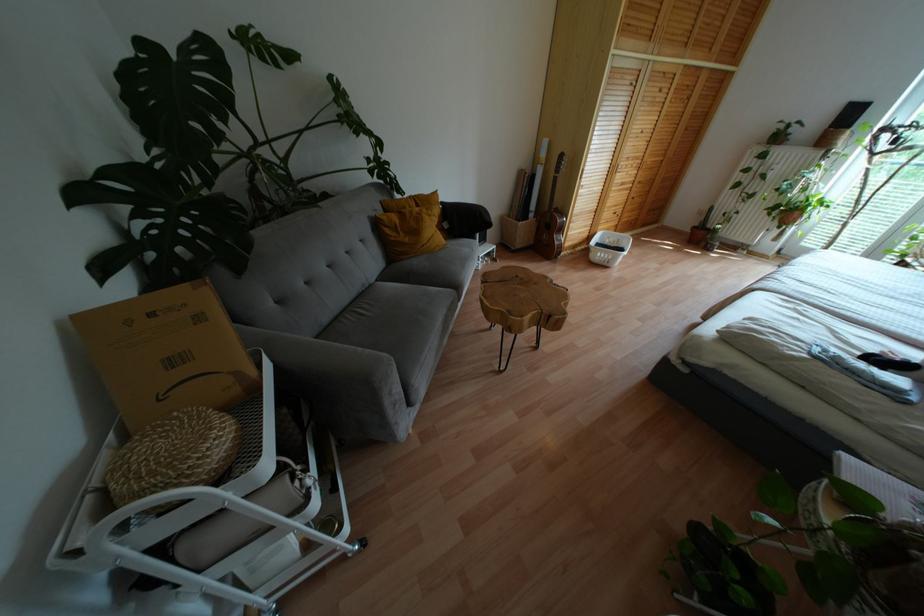
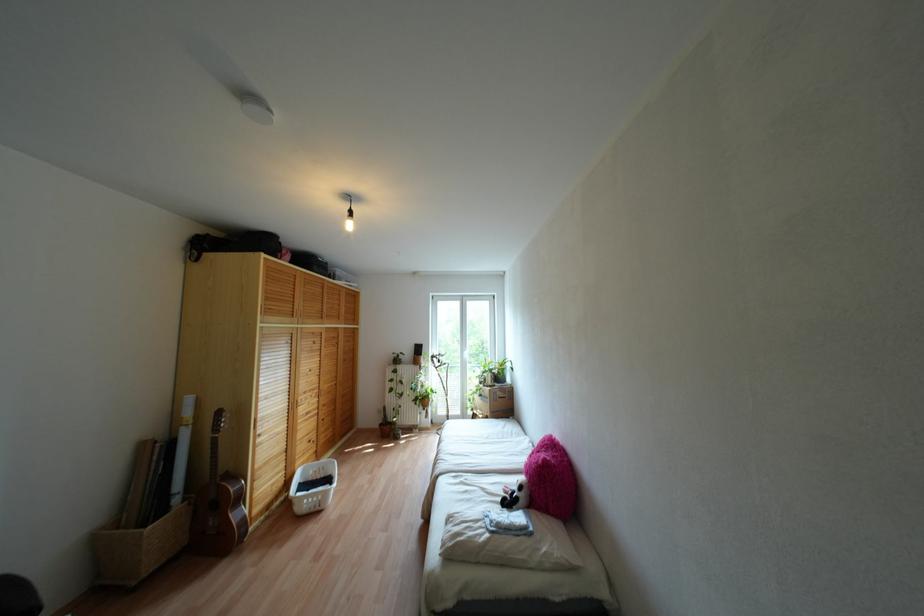
The point at (x=649, y=160) is marked in the first image. Where is the corresponding point in the second image?

(324, 387)